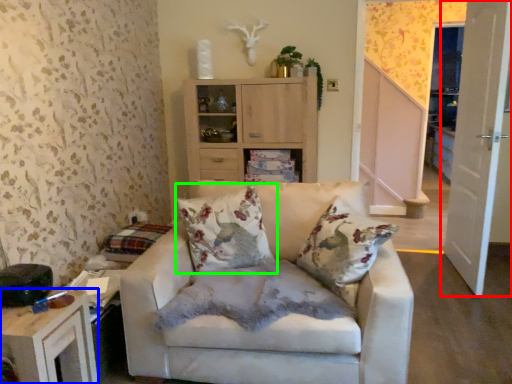
Question: Estimate the real-world distances between objects in this image. Which object is farther from door (highlighted by a red box), table (highlighted by a blue box) or pillow (highlighted by a green box)?

Choices:
 (A) table
 (B) pillow

Answer: (A)